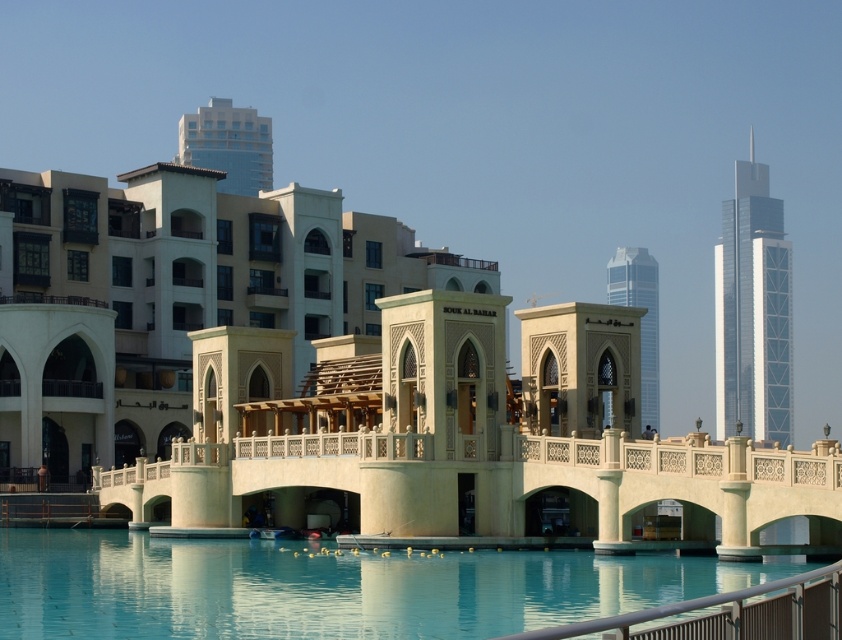
You are an architect analyzing the spatial arrangement of the waterfront scene. Based on the image, does the shiny silver skyscraper at right appear to be closer to the viewer than the glassy blue skyscraper at upper center? Explain your reasoning using their positions in the scene.

The shiny silver skyscraper at right is positioned under the glassy blue skyscraper at upper center, which suggests that the glassy blue skyscraper at upper center is closer to the viewer. In perspective, objects that are lower in the image are typically farther away, so the skyscraper at the right being under the upper one implies it is behind and thus farther back.

You are standing at the waterfront and want to take a photo that includes both the beige stone souk al bahar at center and the shiny silver skyscraper at right. Based on their positions, which structure should you position closer to the front of your camera frame to include both in the shot?

You should position the beige stone souk al bahar at center closer to the front of your camera frame because it is in front of the shiny silver skyscraper at right, allowing both to be captured in the shot.

You are an architect analyzing the waterfront scene. You need to determine which object occupies more horizontal space in the image. Based on the scene description, which one is wider between the smooth concrete pool at center and the shiny silver skyscraper at right?

The smooth concrete pool at center is wider than the shiny silver skyscraper at right according to the description.